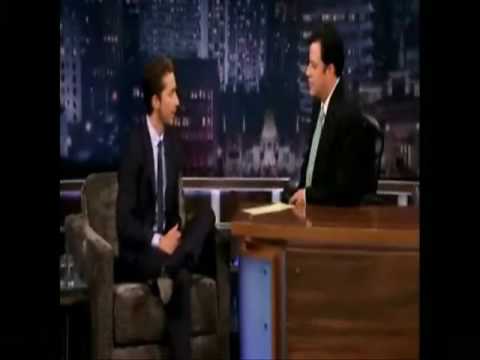
Find the location of a particular element. leather chair is located at coordinates (131, 325).